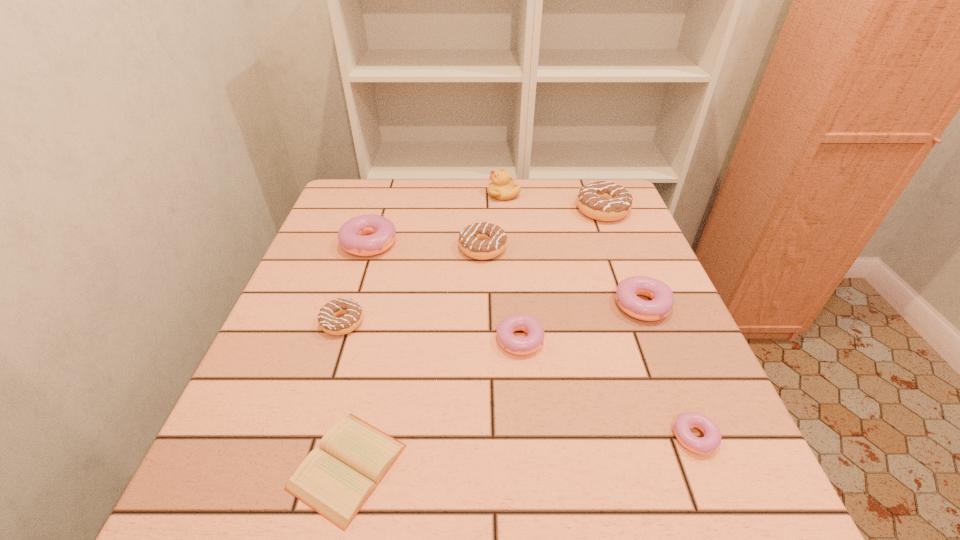
Locate an element on the screen. vacant point located 0.210m on the left of the second chocolate doughnut from left to right is located at coordinates (375, 248).

Find the location of a particular element. free region located 0.130m on the left of the second biggest purple doughnut is located at coordinates (556, 310).

Locate an element on the screen. The image size is (960, 540). free space located on the front of the leftmost chocolate doughnut is located at coordinates (313, 414).

Locate an element on the screen. Image resolution: width=960 pixels, height=540 pixels. vacant region located on the back of the second smallest purple doughnut is located at coordinates pos(515,273).

Where is `vacant region located on the left of the smallest purple doughnut`? vacant region located on the left of the smallest purple doughnut is located at coordinates (425, 437).

Locate an element on the screen. The height and width of the screenshot is (540, 960). vacant position located on the right of the diary is located at coordinates (443, 467).

At what (x,y) coordinates should I click in order to perform the action: click on duckling at the far edge. Please return your answer as a coordinate pair (x, y). Looking at the image, I should click on (502, 188).

Identify the location of object that is at the near edge. This screenshot has height=540, width=960. (335, 480).

The height and width of the screenshot is (540, 960). Identify the location of diary that is at the left edge. pos(335,480).

The height and width of the screenshot is (540, 960). Identify the location of object located in the far left corner section of the desktop. (353, 238).